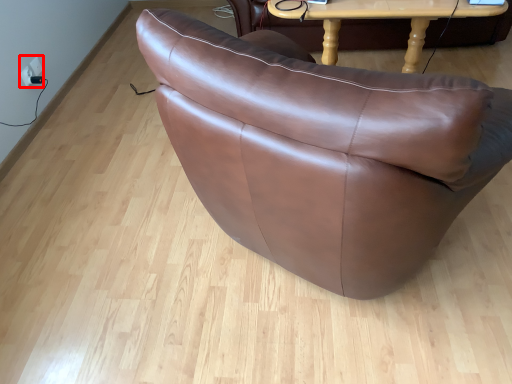
Question: From the image's perspective, considering the relative positions of electric outlet (annotated by the red box) and table in the image provided, where is electric outlet (annotated by the red box) located with respect to the staircase?

Choices:
 (A) above
 (B) below

Answer: (B)